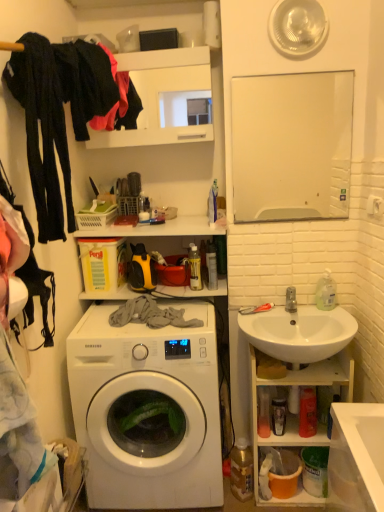
Question: Does white glossy washing machine at center have a larger size compared to white ceramic sink at right?

Choices:
 (A) yes
 (B) no

Answer: (A)

Question: Is white glossy washing machine at center behind white ceramic sink at right?

Choices:
 (A) yes
 (B) no

Answer: (A)

Question: From a real-world perspective, is white glossy washing machine at center physically above white ceramic sink at right?

Choices:
 (A) yes
 (B) no

Answer: (B)

Question: Can you confirm if white glossy washing machine at center is shorter than white ceramic sink at right?

Choices:
 (A) no
 (B) yes

Answer: (A)

Question: Are white glossy washing machine at center and white ceramic sink at right located far from each other?

Choices:
 (A) no
 (B) yes

Answer: (A)

Question: From the image's perspective, is white glossy washing machine at center over white ceramic sink at right?

Choices:
 (A) yes
 (B) no

Answer: (B)

Question: Is white glossy sink at lower right closer to camera compared to silver metallic faucet at sink right?

Choices:
 (A) yes
 (B) no

Answer: (A)

Question: Does white glossy sink at lower right have a greater height compared to silver metallic faucet at sink right?

Choices:
 (A) no
 (B) yes

Answer: (B)

Question: Is the surface of white glossy sink at lower right in direct contact with silver metallic faucet at sink right?

Choices:
 (A) no
 (B) yes

Answer: (A)

Question: From the image's perspective, is white glossy sink at lower right located beneath silver metallic faucet at sink right?

Choices:
 (A) yes
 (B) no

Answer: (A)

Question: Is white glossy sink at lower right to the left of silver metallic faucet at sink right from the viewer's perspective?

Choices:
 (A) yes
 (B) no

Answer: (B)

Question: Does white glossy sink at lower right have a lesser height compared to silver metallic faucet at sink right?

Choices:
 (A) yes
 (B) no

Answer: (B)

Question: Is white ceramic sink at right placed right next to white glossy sink at lower right?

Choices:
 (A) yes
 (B) no

Answer: (B)